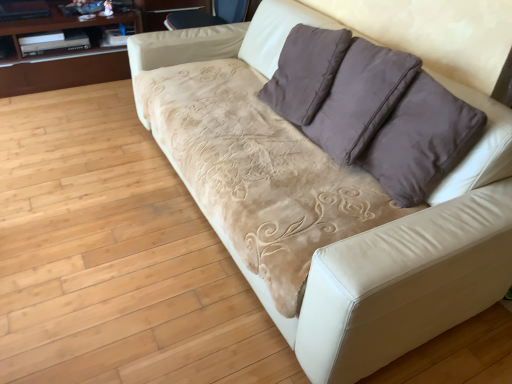
Question: Is velvet beige armchair at upper center positioned with its back to wooden glossy dresser at upper left?

Choices:
 (A) no
 (B) yes

Answer: (A)

Question: Is velvet beige armchair at upper center placed right next to wooden glossy dresser at upper left?

Choices:
 (A) yes
 (B) no

Answer: (B)

Question: From the image's perspective, is velvet beige armchair at upper center beneath wooden glossy dresser at upper left?

Choices:
 (A) yes
 (B) no

Answer: (B)

Question: From the image's perspective, is velvet beige armchair at upper center over wooden glossy dresser at upper left?

Choices:
 (A) yes
 (B) no

Answer: (A)

Question: Can you confirm if velvet beige armchair at upper center is smaller than wooden glossy dresser at upper left?

Choices:
 (A) yes
 (B) no

Answer: (A)

Question: Looking at their shapes, would you say velvet beige armchair at upper center is wider or thinner than wooden glossy dresser at upper left?

Choices:
 (A) wide
 (B) thin

Answer: (B)

Question: From a real-world perspective, is velvet beige armchair at upper center above or below wooden glossy dresser at upper left?

Choices:
 (A) below
 (B) above

Answer: (B)

Question: From the image's perspective, relative to wooden glossy dresser at upper left, is velvet beige armchair at upper center above or below?

Choices:
 (A) below
 (B) above

Answer: (B)

Question: From their relative heights in the image, would you say velvet beige armchair at upper center is taller or shorter than wooden glossy dresser at upper left?

Choices:
 (A) tall
 (B) short

Answer: (B)

Question: From a real-world perspective, is velvet beige armchair at upper center positioned above or below brown suede pillow at upper right?

Choices:
 (A) below
 (B) above

Answer: (A)

Question: From the image's perspective, is velvet beige armchair at upper center located above or below brown suede pillow at upper right?

Choices:
 (A) below
 (B) above

Answer: (B)

Question: Is velvet beige armchair at upper center situated inside brown suede pillow at upper right or outside?

Choices:
 (A) outside
 (B) inside

Answer: (A)

Question: In the image, is velvet beige armchair at upper center on the left side or the right side of brown suede pillow at upper right?

Choices:
 (A) right
 (B) left

Answer: (B)

Question: Visually, is brown suede pillow at upper right positioned to the left or to the right of wooden glossy dresser at upper left?

Choices:
 (A) left
 (B) right

Answer: (B)

Question: Which is correct: brown suede pillow at upper right is inside wooden glossy dresser at upper left, or outside of it?

Choices:
 (A) inside
 (B) outside

Answer: (B)